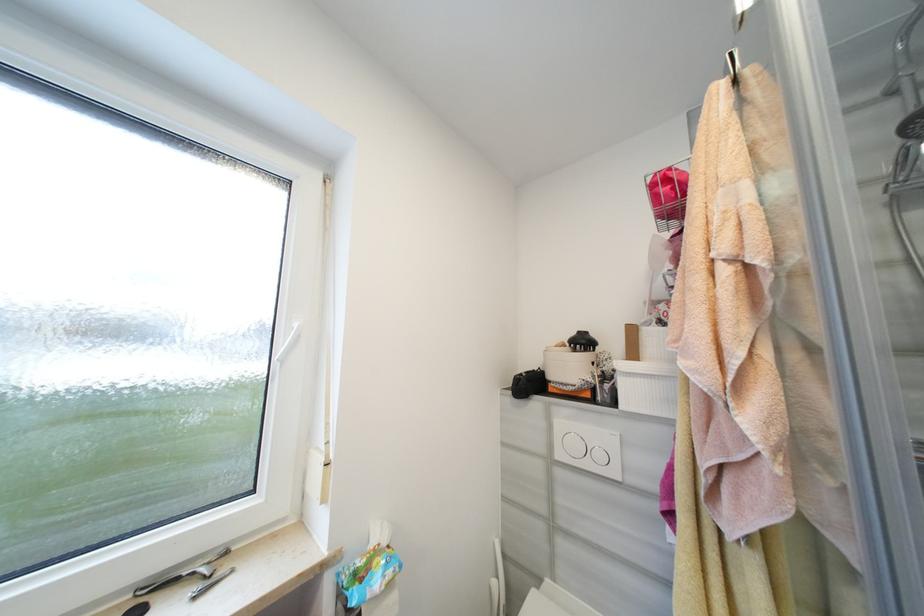
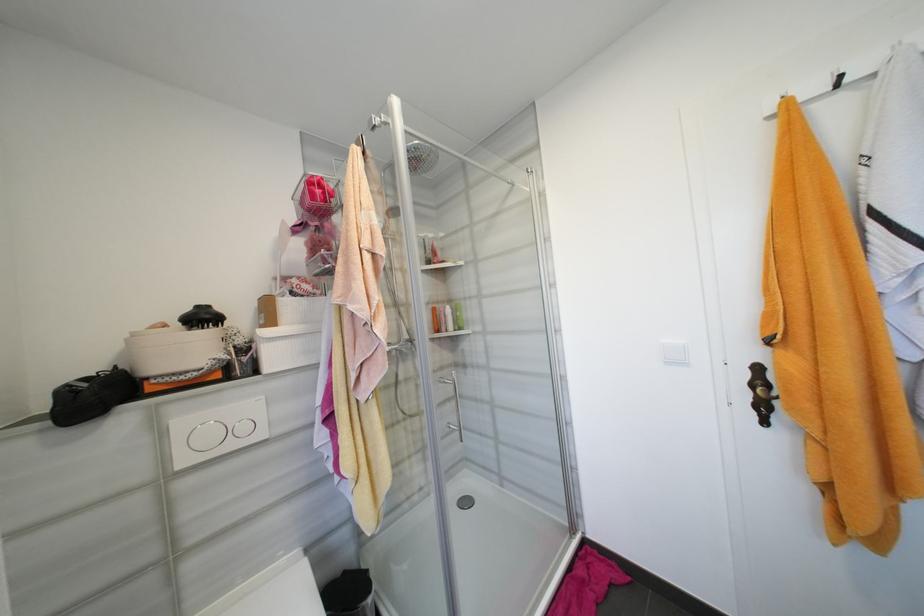
In the second image, find the point that corresponds to (x=588, y=342) in the first image.

(210, 318)